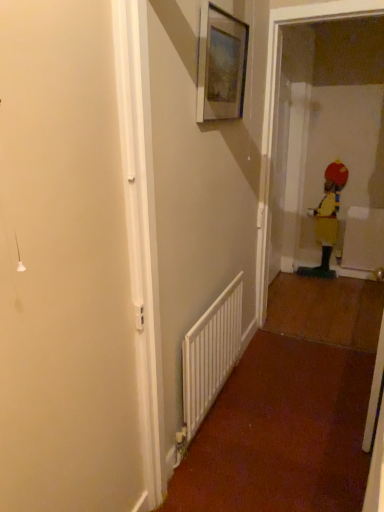
Question: Could you tell me if matte wooden picture frame at upper center is turned towards yellow fabric toddler at right?

Choices:
 (A) no
 (B) yes

Answer: (A)

Question: Does matte wooden picture frame at upper center have a smaller size compared to yellow fabric toddler at right?

Choices:
 (A) no
 (B) yes

Answer: (B)

Question: Is matte wooden picture frame at upper center closer to camera compared to yellow fabric toddler at right?

Choices:
 (A) yes
 (B) no

Answer: (A)

Question: Is matte wooden picture frame at upper center not within yellow fabric toddler at right?

Choices:
 (A) yes
 (B) no

Answer: (A)

Question: From the image's perspective, is matte wooden picture frame at upper center below yellow fabric toddler at right?

Choices:
 (A) no
 (B) yes

Answer: (A)

Question: Does matte wooden picture frame at upper center appear on the right side of yellow fabric toddler at right?

Choices:
 (A) no
 (B) yes

Answer: (A)

Question: Could you tell me if yellow fabric toddler at right is turned towards white plastic radiator at center?

Choices:
 (A) no
 (B) yes

Answer: (B)

Question: Is yellow fabric toddler at right turned away from white plastic radiator at center?

Choices:
 (A) yes
 (B) no

Answer: (B)

Question: Considering the relative sizes of yellow fabric toddler at right and white plastic radiator at center in the image provided, is yellow fabric toddler at right wider than white plastic radiator at center?

Choices:
 (A) yes
 (B) no

Answer: (A)

Question: From the image's perspective, is yellow fabric toddler at right over white plastic radiator at center?

Choices:
 (A) yes
 (B) no

Answer: (A)

Question: Is yellow fabric toddler at right positioned far away from white plastic radiator at center?

Choices:
 (A) yes
 (B) no

Answer: (A)

Question: Is yellow fabric toddler at right completely or partially outside of white plastic radiator at center?

Choices:
 (A) no
 (B) yes

Answer: (B)

Question: From the image's perspective, would you say white plastic radiator at center is shown under yellow fabric toddler at right?

Choices:
 (A) no
 (B) yes

Answer: (B)